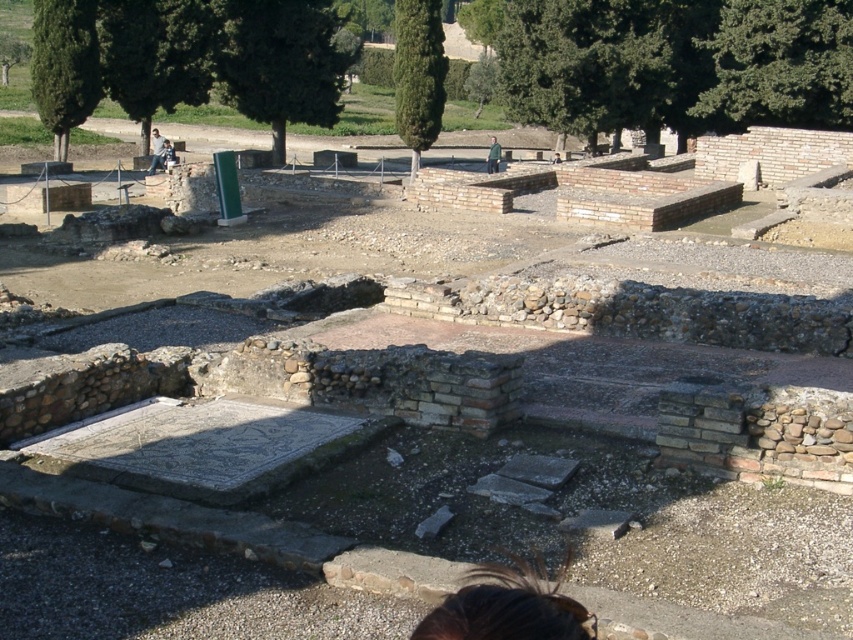
Between brown hair at lower center and green fabric jacket at center, which one is positioned higher?

green fabric jacket at center is higher up.

Does brown hair at lower center have a smaller size compared to green fabric jacket at center?

Yes.

Who is more forward, (515, 630) or (494, 168)?

Point (515, 630)

The height and width of the screenshot is (640, 853). Identify the location of brown hair at lower center. (508, 608).

Does brown hair at lower center appear on the left side of denim jacket at center?

In fact, brown hair at lower center is to the right of denim jacket at center.

Which is behind, point (450, 628) or point (160, 150)?

Positioned behind is point (160, 150).

What do you see at coordinates (508, 608) in the screenshot? I see `brown hair at lower center` at bounding box center [508, 608].

The width and height of the screenshot is (853, 640). What are the coordinates of `brown hair at lower center` in the screenshot? It's located at (508, 608).

Which is behind, point (151, 132) or point (163, 145)?

Positioned behind is point (151, 132).

Measure the distance between point [160,138] and camera.

33.34 meters

Which is in front, point (154, 160) or point (172, 150)?

Point (154, 160) is more forward.

The height and width of the screenshot is (640, 853). I want to click on denim jacket at center, so 155,150.